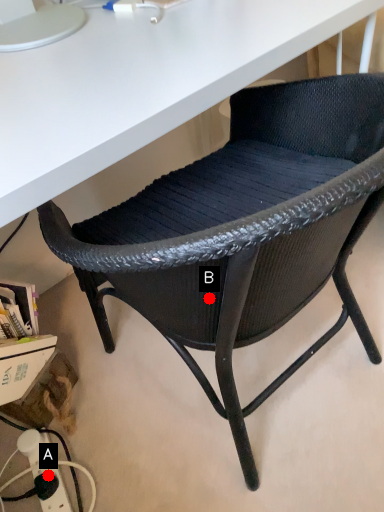
Question: Two points are circled on the image, labeled by A and B beside each circle. Which point appears farthest from the camera in this image?

Choices:
 (A) A is further
 (B) B is further

Answer: (A)